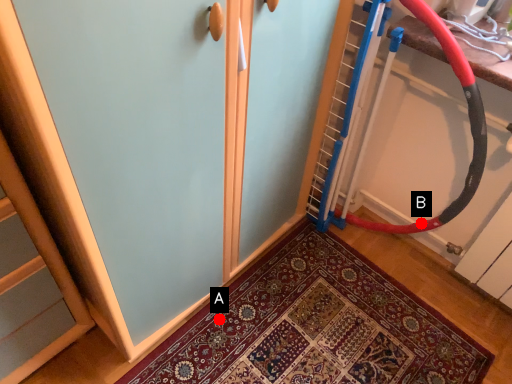
Question: Two points are circled on the image, labeled by A and B beside each circle. Among these points, which one is nearest to the camera?

Choices:
 (A) A is closer
 (B) B is closer

Answer: (A)